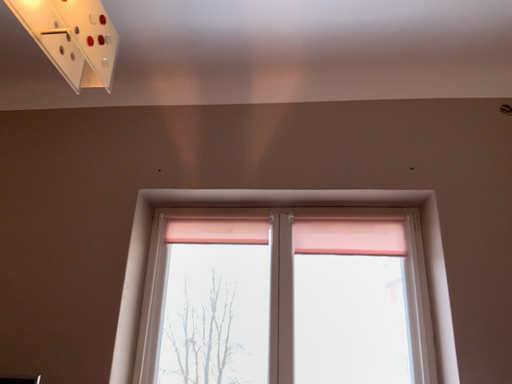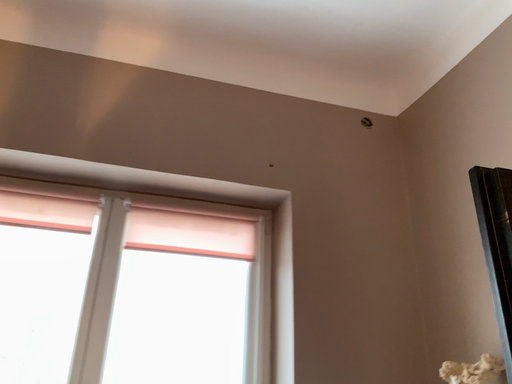
Question: Which way did the camera rotate in the video?

Choices:
 (A) rotated right
 (B) rotated left

Answer: (A)